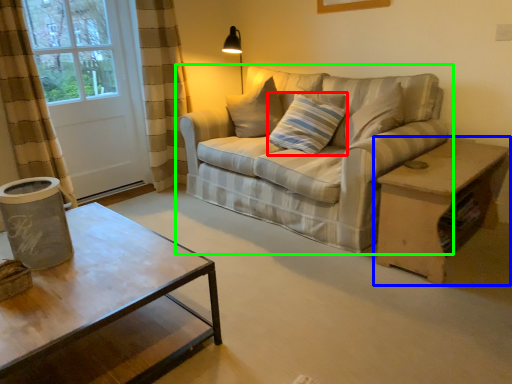
Question: Considering the real-world distances, which object is closest to pillow (highlighted by a red box)? table (highlighted by a blue box) or studio couch (highlighted by a green box).

Choices:
 (A) table
 (B) studio couch

Answer: (B)